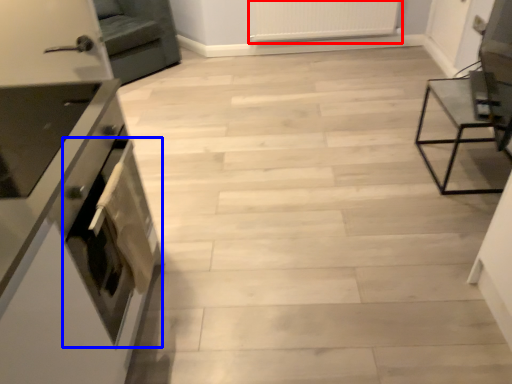
Question: Among these objects, which one is nearest to the camera, radiator (highlighted by a red box) or oven (highlighted by a blue box)?

Choices:
 (A) radiator
 (B) oven

Answer: (B)